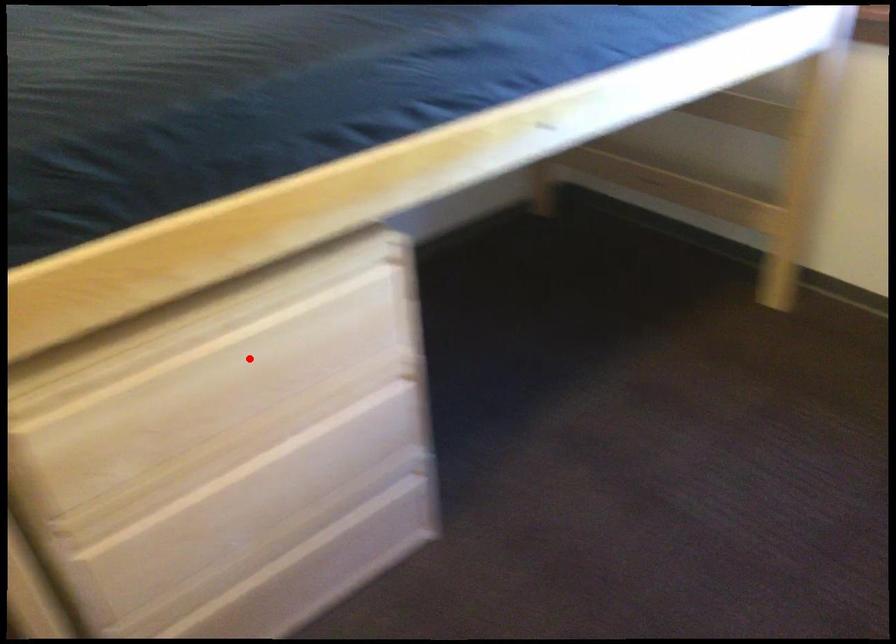
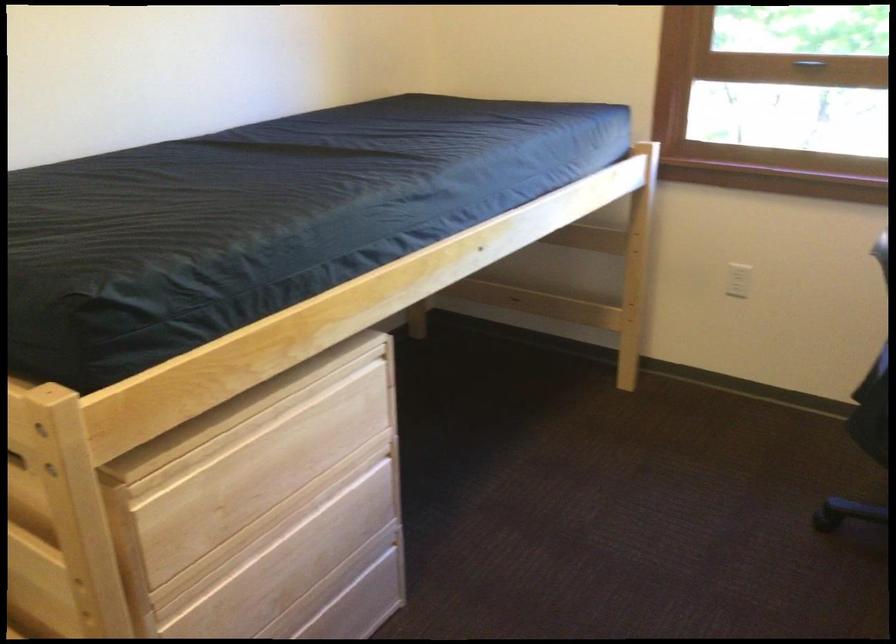
In the second image, find the point that corresponds to the highlighted location in the first image.

(285, 448)